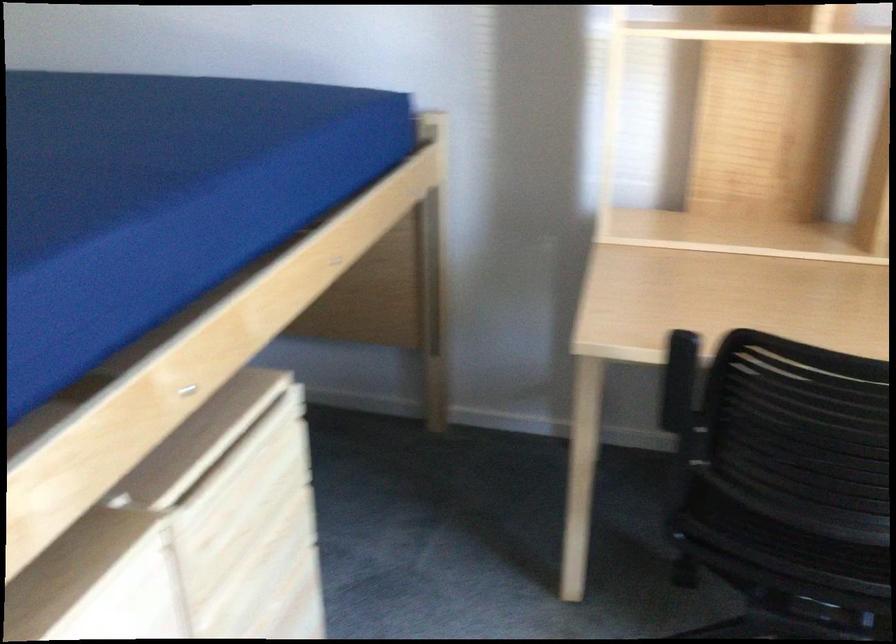
This screenshot has width=896, height=644. Describe the element at coordinates (754, 556) in the screenshot. I see `a black chair armrest` at that location.